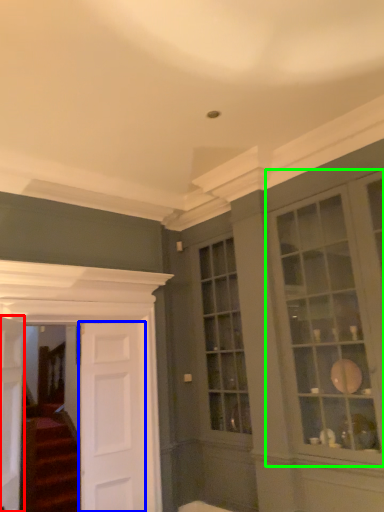
Question: Estimate the real-world distances between objects in this image. Which object is farther from door (highlighted by a red box), door (highlighted by a blue box) or window (highlighted by a green box)?

Choices:
 (A) door
 (B) window

Answer: (B)